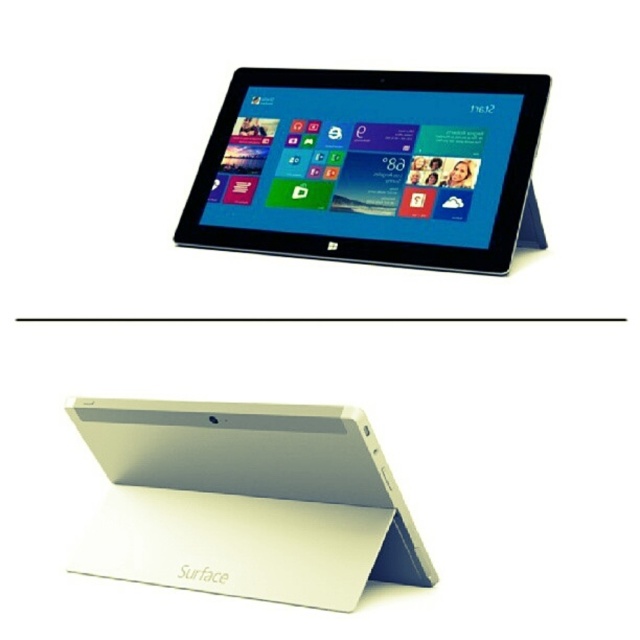
You are setting up a presentation and need to position your white matte tablet at upper center precisely at coordinates 0.261, 0.578. Can you confirm if the tablet is already placed correctly based on the image?

The white matte tablet at upper center is located at point (369, 166), so yes, it is correctly positioned at those coordinates.

You are looking at the top section of the image where the tablet is in portrait orientation. There is a point labeled as point (x=369, y=166). Is this point located on the white matte tablet at upper center?

The white matte tablet at upper center is represented by point (x=369, y=166), so yes, the point is located on the white matte tablet at upper center.

You are setting up a presentation on the white matte tablet at upper center and need to place a small note card on the white matte surface at upper center. Based on the scene, will the note card fit on the surface if it is the same size as the tablet?

The white matte tablet at upper center is taller than the white matte surface at upper center, so the note card, being the same size as the tablet, would not fit on the surface.